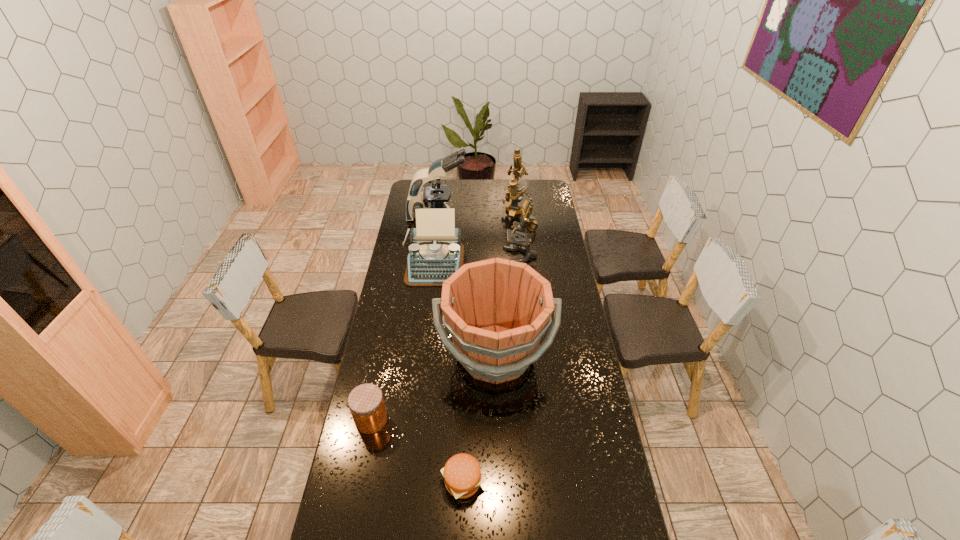
The height and width of the screenshot is (540, 960). I want to click on the leftmost microscope, so click(434, 196).

You are a GUI agent. You are given a task and a screenshot of the screen. Output one action in this format:
    pyautogui.click(x=<x>, y=<y>)
    Task: Click on the fifth farthest object
    The height and width of the screenshot is (540, 960).
    Given the screenshot: What is the action you would take?
    pyautogui.click(x=496, y=310)

Locate an element on the screen. The height and width of the screenshot is (540, 960). the shortest microscope is located at coordinates (528, 222).

This screenshot has height=540, width=960. I want to click on typewriter, so click(435, 252).

Identify the location of jar. The width and height of the screenshot is (960, 540). (366, 403).

This screenshot has height=540, width=960. Identify the location of the second shortest object. (366, 403).

At what (x,y) coordinates should I click in order to perform the action: click on the shortest object. Please return your answer as a coordinate pair (x, y). The height and width of the screenshot is (540, 960). Looking at the image, I should click on click(x=462, y=474).

Locate an element on the screen. This screenshot has width=960, height=540. hamburger is located at coordinates (462, 474).

This screenshot has width=960, height=540. Identify the location of vacant space located through the eyepieces of the leftmost microscope. (533, 214).

Identify the location of free point located 0.240m on the handle side of the fifth farthest object. The height and width of the screenshot is (540, 960). (498, 461).